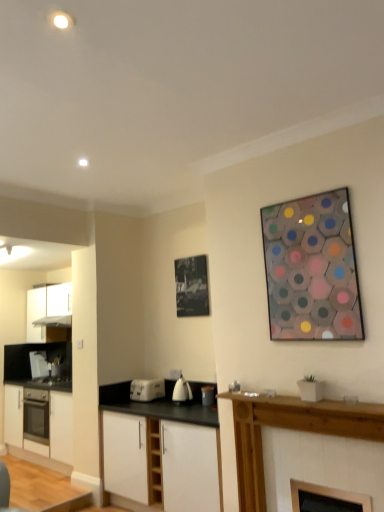
Question: From the image's perspective, is satin silver exhaust hood at left positioned above or below white plastic toaster at lower center, placed as the 2th kitchen appliance when sorted from front to back?

Choices:
 (A) above
 (B) below

Answer: (A)

Question: In terms of width, does satin silver exhaust hood at left look wider or thinner when compared to white plastic toaster at lower center, marked as the first kitchen appliance in a back-to-front arrangement?

Choices:
 (A) wide
 (B) thin

Answer: (A)

Question: Estimate the real-world distances between objects in this image. Which object is closer to the black paper at upper center, the 2th picture frame in the front-to-back sequence?

Choices:
 (A) white matte cabinet at lower center, acting as the third cabinetry starting from the back
 (B) white matte cabinet at left, placed as the second cabinetry when sorted from back to front
 (C) satin silver exhaust hood at left
 (D) wooden fireplace at lower right, which appears as the first cabinetry when viewed from the right
 (E) white glossy cabinets at left, the 2th cabinetry when ordered from left to right

Answer: (A)

Question: Considering the real-world distances, which object is farthest from the metallic hexagon art at upper right, which ranks as the first picture frame in right-to-left order?

Choices:
 (A) white matte cabinet at lower center, acting as the third cabinetry starting from the back
 (B) wooden fireplace at lower right, the 4th cabinetry viewed from the back
 (C) black glass fireplace at lower center, marked as the first appliance in a front-to-back arrangement
 (D) metallic silver toaster at center, the second appliance in the back-to-front sequence
 (E) white glossy kettle at center, the 2th kitchen appliance positioned from the back

Answer: (E)